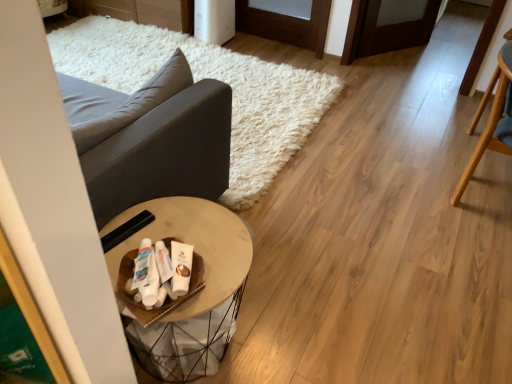
The image size is (512, 384). Find the location of `free spot to the right of wooden round table at center`. free spot to the right of wooden round table at center is located at coordinates (293, 325).